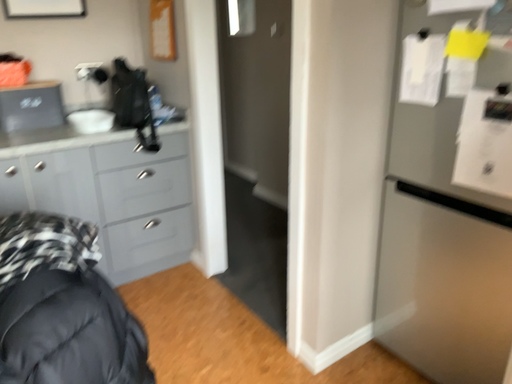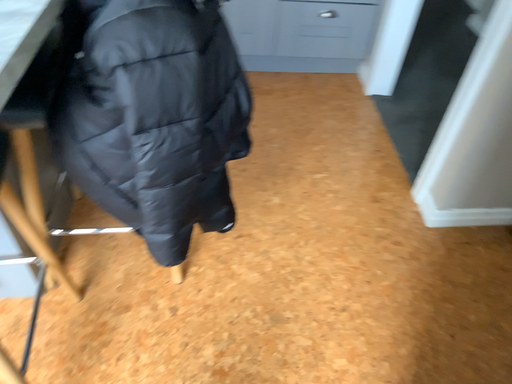
Question: Which way did the camera rotate in the video?

Choices:
 (A) rotated left
 (B) rotated right

Answer: (A)